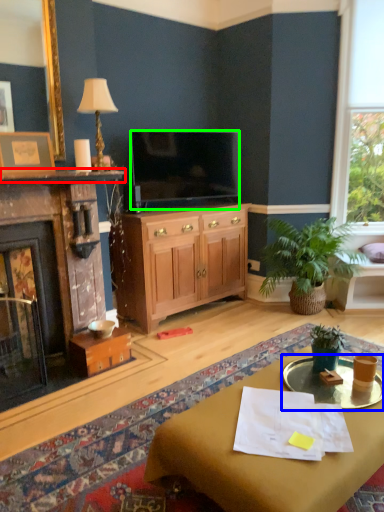
Question: Which object is the closest to the mantle (highlighted by a red box)? Choose among these: glass table (highlighted by a blue box) or television (highlighted by a green box).

Choices:
 (A) glass table
 (B) television

Answer: (B)